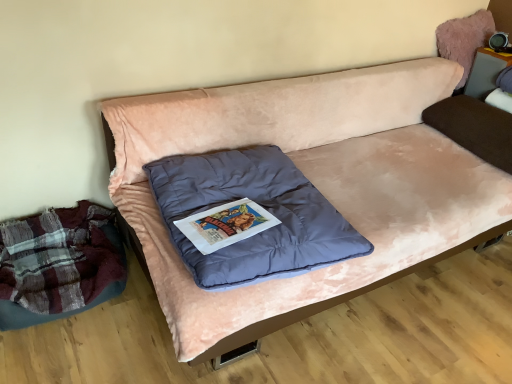
Question: Does velvet pink couch at center have a lesser height compared to fuzzy pink bean bag at upper right?

Choices:
 (A) yes
 (B) no

Answer: (B)

Question: Is velvet pink couch at center at the right side of fuzzy pink bean bag at upper right?

Choices:
 (A) yes
 (B) no

Answer: (B)

Question: From the image's perspective, is velvet pink couch at center above fuzzy pink bean bag at upper right?

Choices:
 (A) yes
 (B) no

Answer: (B)

Question: Is velvet pink couch at center closer to camera compared to fuzzy pink bean bag at upper right?

Choices:
 (A) yes
 (B) no

Answer: (A)

Question: Does velvet pink couch at center have a lesser width compared to fuzzy pink bean bag at upper right?

Choices:
 (A) yes
 (B) no

Answer: (B)

Question: Does velvet pink couch at center have a greater height compared to fuzzy pink bean bag at upper right?

Choices:
 (A) no
 (B) yes

Answer: (B)

Question: From a real-world perspective, is brown velvety pillow at right, the first pillow when ordered from back to front, physically below velvet blue pillow at center, marked as the second pillow in a back-to-front arrangement?

Choices:
 (A) yes
 (B) no

Answer: (B)

Question: Is brown velvety pillow at right, the first pillow when ordered from back to front, taller than velvet blue pillow at center, which ranks as the second pillow in right-to-left order?

Choices:
 (A) yes
 (B) no

Answer: (A)

Question: Is velvet blue pillow at center, marked as the second pillow in a back-to-front arrangement, a part of brown velvety pillow at right, arranged as the 1th pillow when viewed from the right?

Choices:
 (A) no
 (B) yes

Answer: (A)

Question: Does brown velvety pillow at right, the second pillow in the left-to-right sequence, have a larger size compared to velvet blue pillow at center, which ranks as the first pillow in left-to-right order?

Choices:
 (A) no
 (B) yes

Answer: (A)

Question: Is brown velvety pillow at right, arranged as the 1th pillow when viewed from the right, next to velvet blue pillow at center, marked as the second pillow in a back-to-front arrangement, and touching it?

Choices:
 (A) no
 (B) yes

Answer: (A)

Question: Considering the relative positions of brown velvety pillow at right, the second pillow in the left-to-right sequence, and velvet blue pillow at center, arranged as the first pillow when viewed from the front, in the image provided, is brown velvety pillow at right, the second pillow in the left-to-right sequence, in front of velvet blue pillow at center, arranged as the first pillow when viewed from the front,?

Choices:
 (A) no
 (B) yes

Answer: (A)

Question: Is brown velvety pillow at right, acting as the second pillow starting from the front, closer to camera compared to matte gray speaker at upper right?

Choices:
 (A) yes
 (B) no

Answer: (A)